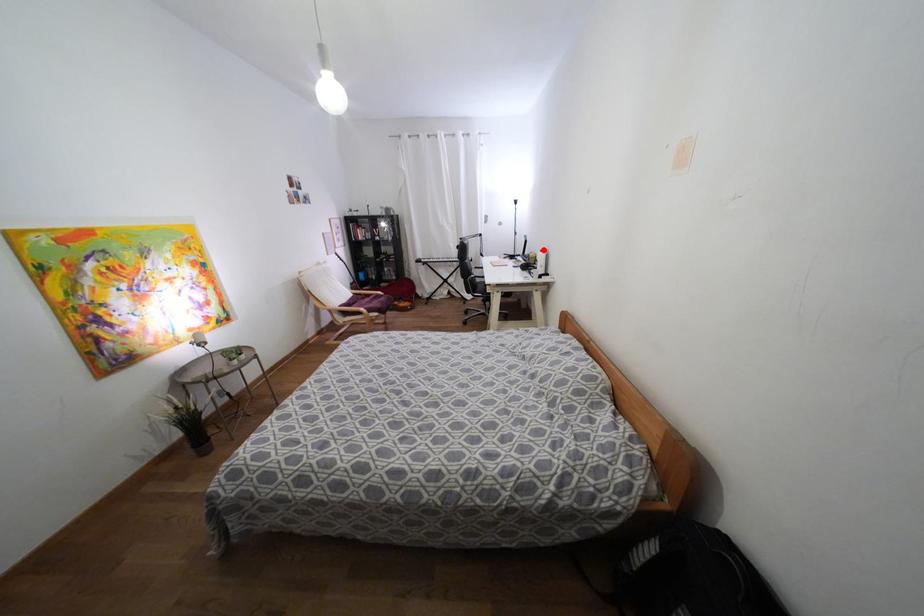
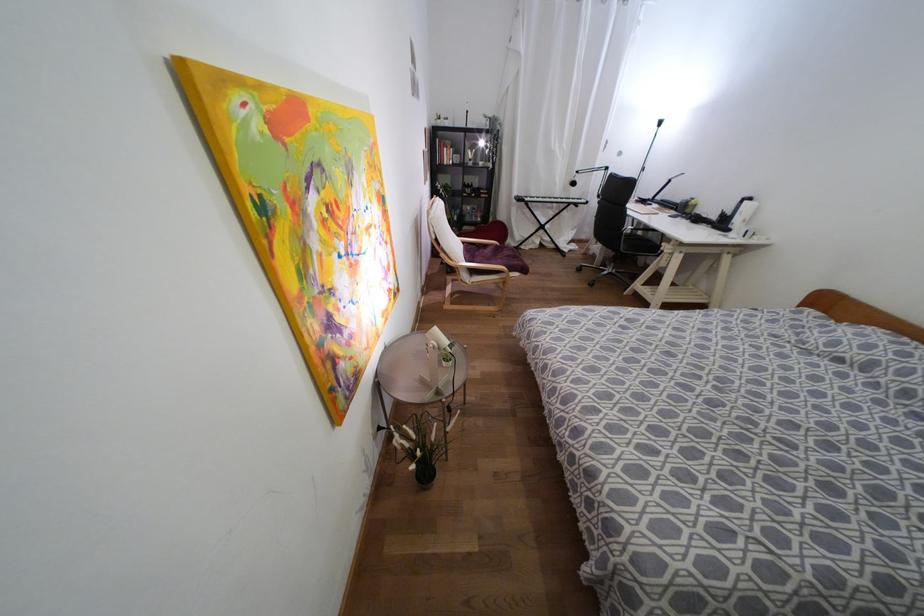
Question: A red point is marked in image1. In image2, is the corresponding 3D point closer to the camera or farther? Reply with the corresponding letter.

Choices:
 (A) The corresponding 3D point is closer.
 (B) The corresponding 3D point is farther.

Answer: (B)